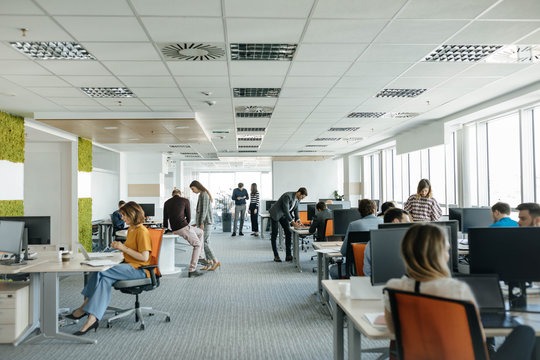
This screenshot has height=360, width=540. In order to click on air vents in this screenshot , I will do `click(202, 44)`, `click(518, 48)`, `click(406, 114)`, `click(249, 109)`, `click(352, 136)`, `click(252, 135)`.